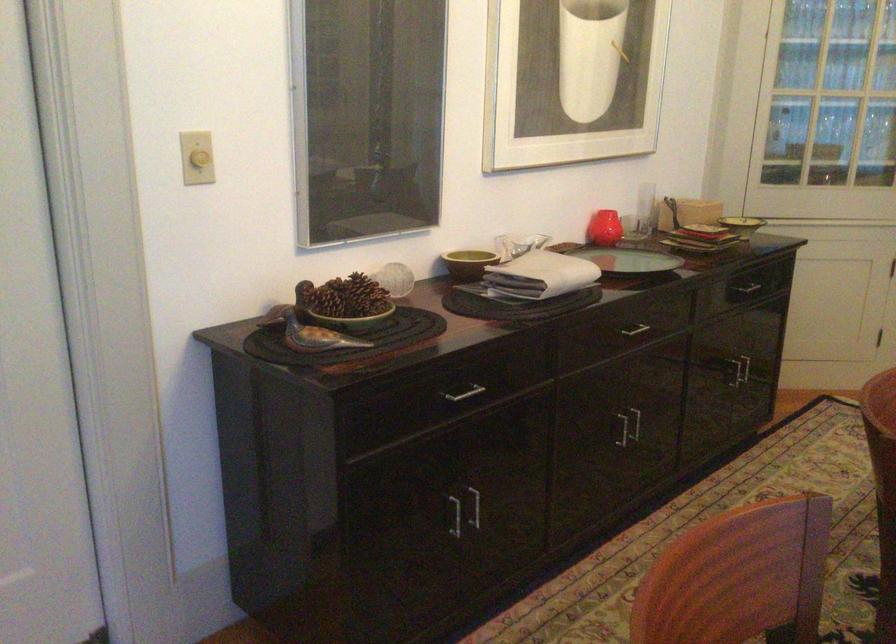
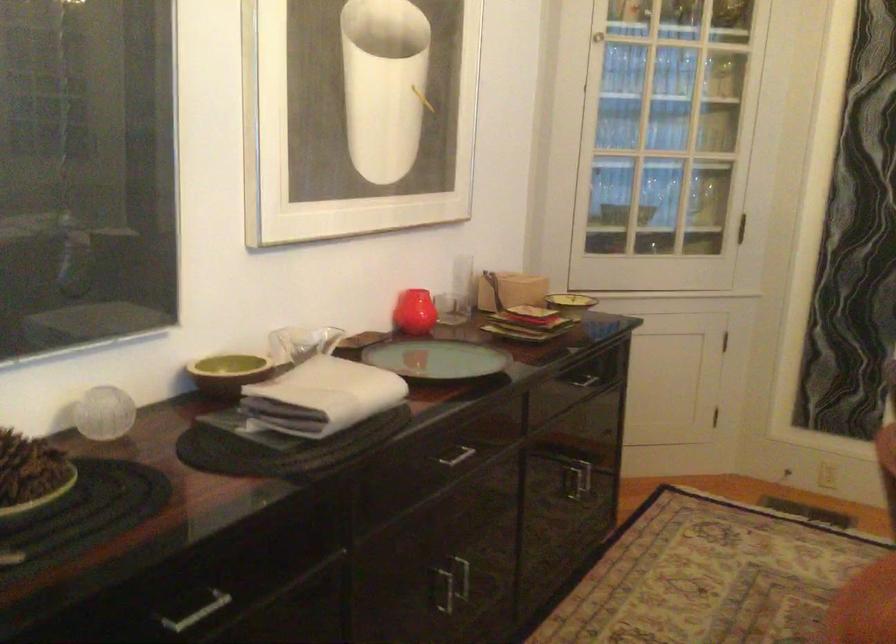
Question: What movement of the cameraman would produce the second image?

Choices:
 (A) Left
 (B) Right
 (C) Forward
 (D) Backward

Answer: (C)